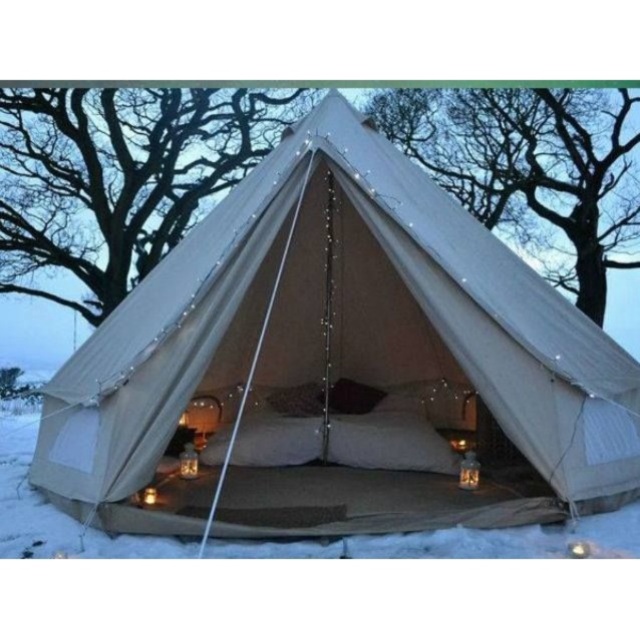
You are planning to set up a small campfire between the beige canvas tent at center and the white soft snow at center. The campfire requires a minimum of 3 meters of space between the tent and the snow. Is this possible?

The beige canvas tent at center and white soft snow at center are 3.49 meters apart, which is more than the required 3 meters. Therefore, you can safely set up the campfire between them with enough space.

You are planning to set up a small campfire in the area. Given the beige canvas tent at center and the white soft snow at center, which object should you place the campfire farther away from to avoid melting the snow?

You should place the campfire farther away from the white soft snow at center to avoid melting it, since the beige canvas tent at center is positioned to the right of the white soft snow at center, so the snow is closer to the campfire if placed near the tent.

You are planning to set up a camping tent in this area. Based on the image, which object is taller between the beige canvas tent at center and the white soft snow at center?

The beige canvas tent at center is much taller than the white soft snow at center according to the description.